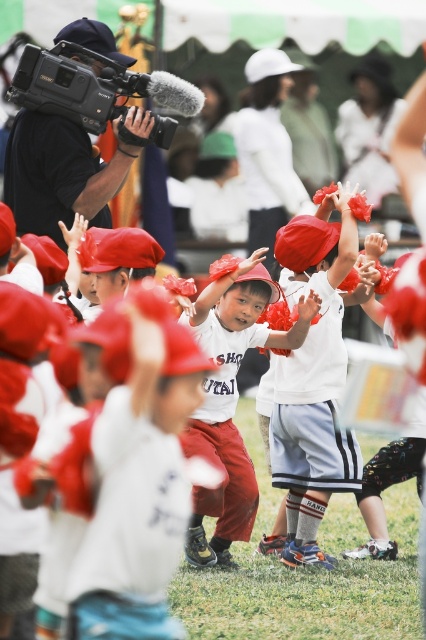
Question: Is matte white shirt at center further to camera compared to white matte shirt at center?

Choices:
 (A) no
 (B) yes

Answer: (A)

Question: Considering the relative positions of matte white shirt at center and white matte shirt at center in the image provided, where is matte white shirt at center located with respect to white matte shirt at center?

Choices:
 (A) below
 (B) above

Answer: (A)

Question: Can you confirm if matte white shirt at center is wider than black plastic video camera at upper left?

Choices:
 (A) yes
 (B) no

Answer: (B)

Question: Which point is farther from the camera taking this photo?

Choices:
 (A) (285, 339)
 (B) (126, 428)

Answer: (A)

Question: Based on their relative distances, which object is farther from the matte white shirt at center?

Choices:
 (A) white matte shirt at center
 (B) white cotton shirt at center
 (C) black plastic video camera at upper left

Answer: (C)

Question: Estimate the real-world distances between objects in this image. Which object is farther from the white matte shirt at center?

Choices:
 (A) black plastic video camera at upper left
 (B) matte white shirt at center

Answer: (B)